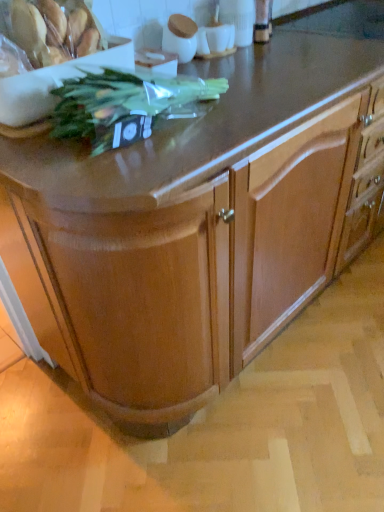
Question: Considering the positions of translucent plastic bag of cookies at upper left and green leafy plant at upper left in the image, is translucent plastic bag of cookies at upper left taller or shorter than green leafy plant at upper left?

Choices:
 (A) tall
 (B) short

Answer: (A)

Question: Visually, is translucent plastic bag of cookies at upper left positioned to the left or to the right of green leafy plant at upper left?

Choices:
 (A) right
 (B) left

Answer: (B)

Question: From the image's perspective, is translucent plastic bag of cookies at upper left positioned above or below green leafy plant at upper left?

Choices:
 (A) above
 (B) below

Answer: (A)

Question: Choose the correct answer: Is green leafy plant at upper left inside translucent plastic bag of cookies at upper left or outside it?

Choices:
 (A) inside
 (B) outside

Answer: (B)

Question: Considering the positions of green leafy plant at upper left and translucent plastic bag of cookies at upper left in the image, is green leafy plant at upper left wider or thinner than translucent plastic bag of cookies at upper left?

Choices:
 (A) thin
 (B) wide

Answer: (B)

Question: From a real-world perspective, is green leafy plant at upper left positioned above or below translucent plastic bag of cookies at upper left?

Choices:
 (A) below
 (B) above

Answer: (A)

Question: From the image's perspective, is green leafy plant at upper left positioned above or below translucent plastic bag of cookies at upper left?

Choices:
 (A) below
 (B) above

Answer: (A)